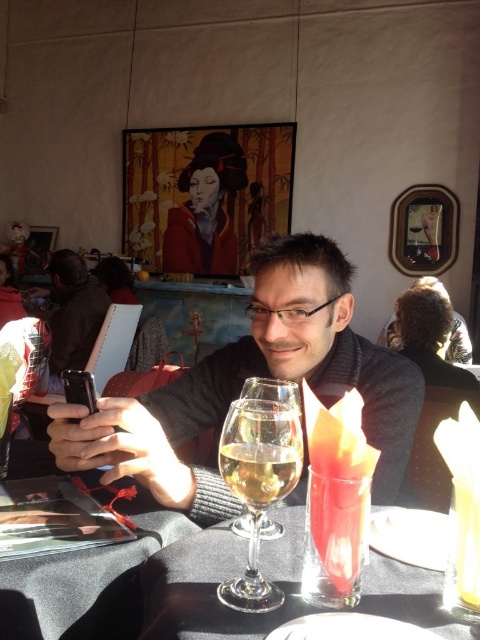
Can you confirm if matte black phone at left is shorter than translucent glass wine at center?

Incorrect, matte black phone at left's height does not fall short of translucent glass wine at center's.

Who is more forward, (62, 256) or (276, 472)?

Point (276, 472) is more forward.

Locate an element on the screen. The height and width of the screenshot is (640, 480). matte black phone at left is located at coordinates (71, 312).

From the picture: Is knitted sweater at center thinner than clear glass at center?

In fact, knitted sweater at center might be wider than clear glass at center.

Is knitted sweater at center shorter than clear glass at center?

No.

Does point (201, 502) come behind point (305, 604)?

Yes, it is.

Locate an element on the screen. Image resolution: width=480 pixels, height=640 pixels. knitted sweater at center is located at coordinates (254, 374).

Which is more to the left, clear glass wine glass at center or matte black phone at left?

Positioned to the left is matte black phone at left.

Who is higher up, clear glass wine glass at center or matte black phone at left?

matte black phone at left is higher up.

Who is more distant from viewer, (299, 467) or (75, 269)?

Point (75, 269)

The image size is (480, 640). Identify the location of clear glass wine glass at center. (257, 484).